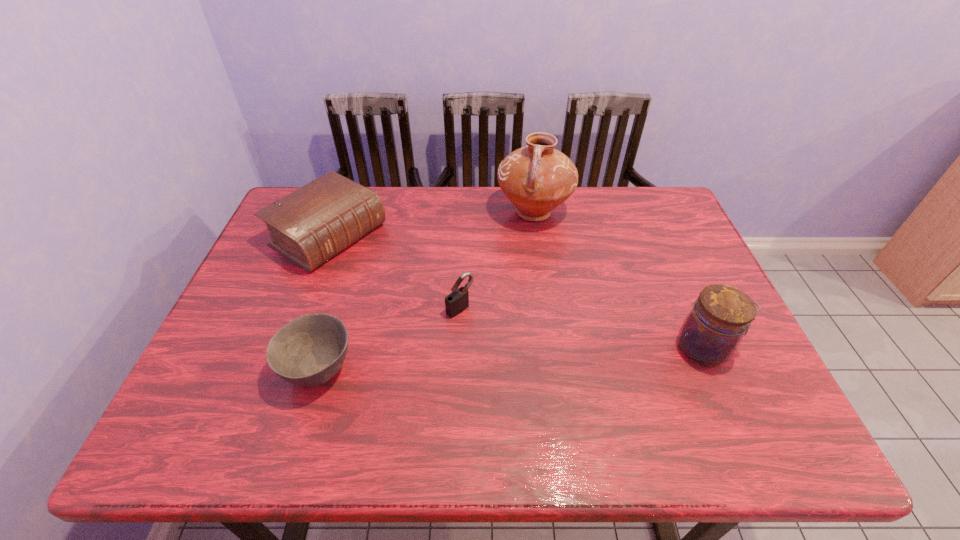
This screenshot has width=960, height=540. In order to click on object at the near edge in this screenshot , I will do `click(308, 351)`.

This screenshot has height=540, width=960. Find the location of `object that is at the left edge`. object that is at the left edge is located at coordinates (311, 225).

Locate an element on the screen. Image resolution: width=960 pixels, height=540 pixels. object that is at the right edge is located at coordinates (712, 331).

Find the location of a particular element. object that is at the far left corner is located at coordinates (311, 225).

Locate an element on the screen. The image size is (960, 540). vacant area at the far edge of the desktop is located at coordinates (574, 202).

You are a GUI agent. You are given a task and a screenshot of the screen. Output one action in this format:
    pyautogui.click(x=<x>, y=<y>)
    Task: Click on the free spot at the near edge of the desktop
    This screenshot has height=540, width=960.
    Given the screenshot: What is the action you would take?
    pyautogui.click(x=596, y=406)

Image resolution: width=960 pixels, height=540 pixels. In the image, there is a desktop. In order to click on free space at the left edge in this screenshot , I will do `click(261, 275)`.

This screenshot has height=540, width=960. I want to click on vacant area at the far left corner of the desktop, so click(300, 186).

You are a GUI agent. You are given a task and a screenshot of the screen. Output one action in this format:
    pyautogui.click(x=<x>, y=<y>)
    Task: Click on the free region at the near right corner of the desktop
    The image size is (960, 540).
    Given the screenshot: What is the action you would take?
    pyautogui.click(x=760, y=403)

Image resolution: width=960 pixels, height=540 pixels. Identify the location of vacant area that lies between the Bible and the pottery. (431, 224).